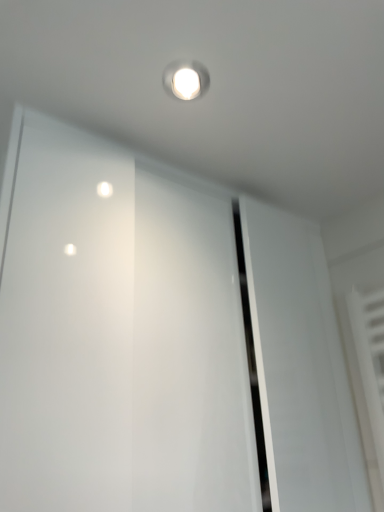
What is the approximate height of transparent glass screen door at upper center?

It is 87.57 centimeters.

Identify the location of transparent glass screen door at upper center. The width and height of the screenshot is (384, 512). (118, 333).

Describe the element at coordinates (118, 333) in the screenshot. I see `transparent glass screen door at upper center` at that location.

Where is `transparent glass screen door at upper center`? The height and width of the screenshot is (512, 384). transparent glass screen door at upper center is located at coordinates (118, 333).